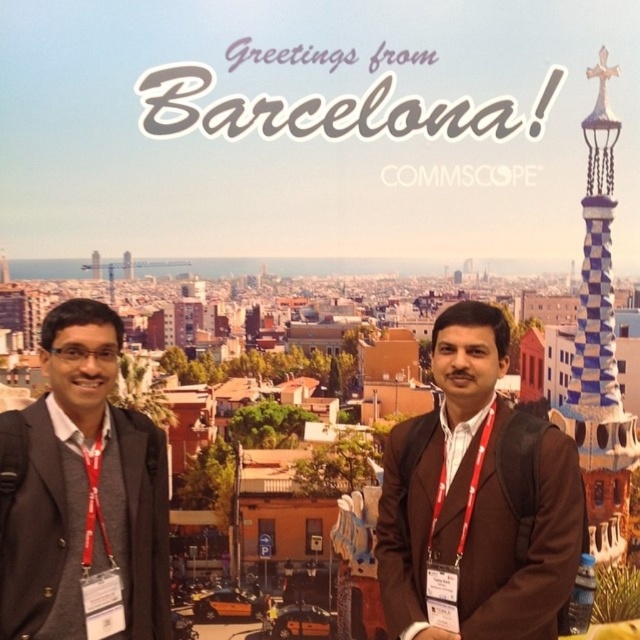
Question: Which object appears farthest from the camera in this image?

Choices:
 (A) brown matte jacket at center
 (B) dark gray suit at left

Answer: (A)

Question: Is the position of brown matte jacket at center less distant than that of dark gray suit at left?

Choices:
 (A) yes
 (B) no

Answer: (B)

Question: Does brown matte jacket at center come in front of dark gray suit at left?

Choices:
 (A) yes
 (B) no

Answer: (B)

Question: Which point is closer to the camera?

Choices:
 (A) (444, 426)
 (B) (13, 616)

Answer: (B)

Question: Can you confirm if brown matte jacket at center is bigger than dark gray suit at left?

Choices:
 (A) yes
 (B) no

Answer: (A)